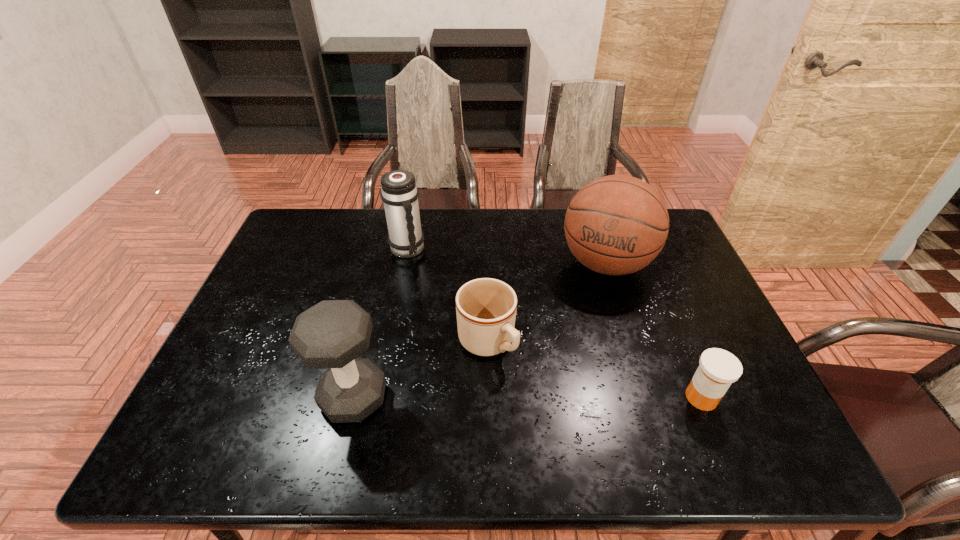
Where is `empty location between the thermos bottle and the dumbbell`? empty location between the thermos bottle and the dumbbell is located at coordinates (380, 323).

Point out which object is positioned as the second nearest to the basketball. Please provide its 2D coordinates. Your answer should be formatted as a tuple, i.e. [(x, y)], where the tuple contains the x and y coordinates of a point satisfying the conditions above.

[(718, 369)]

Where is `the second closest object to the third object from left to right`? the second closest object to the third object from left to right is located at coordinates (615, 225).

This screenshot has height=540, width=960. Find the location of `free spot that satisfies the following two spatial constraints: 1. on the back side of the basketball; 2. on the left side of the dumbbell`. free spot that satisfies the following two spatial constraints: 1. on the back side of the basketball; 2. on the left side of the dumbbell is located at coordinates pos(386,263).

This screenshot has width=960, height=540. I want to click on free space that satisfies the following two spatial constraints: 1. on the front side of the mug; 2. on the label of the medicine, so [x=488, y=397].

Where is `free space that satisfies the following two spatial constraints: 1. on the front side of the thermos bottle; 2. on the label of the medicine`? The image size is (960, 540). free space that satisfies the following two spatial constraints: 1. on the front side of the thermos bottle; 2. on the label of the medicine is located at coordinates (379, 397).